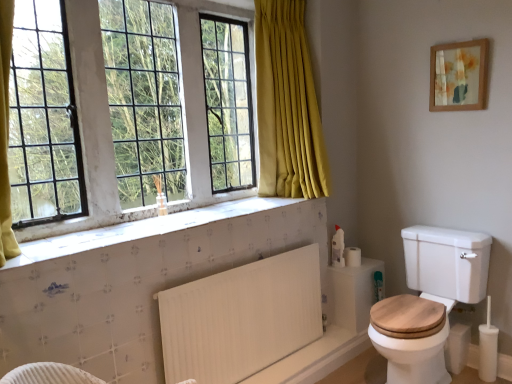
Question: Can you confirm if white matte toilet paper at right is wider than wooden framed artwork at upper right?

Choices:
 (A) no
 (B) yes

Answer: (B)

Question: Can you confirm if white matte toilet paper at right is shorter than wooden framed artwork at upper right?

Choices:
 (A) yes
 (B) no

Answer: (A)

Question: From a real-world perspective, is white matte toilet paper at right under wooden framed artwork at upper right?

Choices:
 (A) no
 (B) yes

Answer: (B)

Question: Is white matte toilet paper at right taller than wooden framed artwork at upper right?

Choices:
 (A) yes
 (B) no

Answer: (B)

Question: Is white matte toilet paper at right located outside wooden framed artwork at upper right?

Choices:
 (A) no
 (B) yes

Answer: (B)

Question: From the image's perspective, relative to wooden framed artwork at upper right, is white ribbed radiator at lower center above or below?

Choices:
 (A) above
 (B) below

Answer: (B)

Question: Based on their positions, is white ribbed radiator at lower center located to the left or right of wooden framed artwork at upper right?

Choices:
 (A) right
 (B) left

Answer: (B)

Question: From a real-world perspective, is white ribbed radiator at lower center physically located above or below wooden framed artwork at upper right?

Choices:
 (A) above
 (B) below

Answer: (B)

Question: Relative to wooden framed artwork at upper right, is white ribbed radiator at lower center in front or behind?

Choices:
 (A) front
 (B) behind

Answer: (A)

Question: From their relative heights in the image, would you say white wood toilet at lower right is taller or shorter than wooden framed artwork at upper right?

Choices:
 (A) short
 (B) tall

Answer: (B)

Question: Is white wood toilet at lower right inside the boundaries of wooden framed artwork at upper right, or outside?

Choices:
 (A) outside
 (B) inside

Answer: (A)

Question: Does point (463, 241) appear closer or farther from the camera than point (437, 91)?

Choices:
 (A) farther
 (B) closer

Answer: (B)

Question: From a real-world perspective, is white wood toilet at lower right positioned above or below wooden framed artwork at upper right?

Choices:
 (A) below
 (B) above

Answer: (A)

Question: Is white glass window at upper left in front of or behind white textured tile at lower center in the image?

Choices:
 (A) behind
 (B) front

Answer: (A)

Question: From a real-world perspective, is white glass window at upper left physically located above or below white textured tile at lower center?

Choices:
 (A) below
 (B) above

Answer: (B)